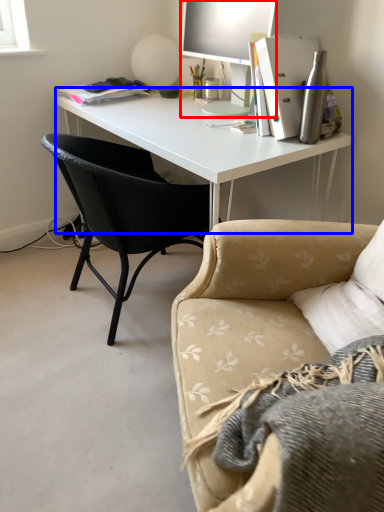
Question: Which of the following is the farthest to the observer, television (highlighted by a red box) or desk (highlighted by a blue box)?

Choices:
 (A) television
 (B) desk

Answer: (A)